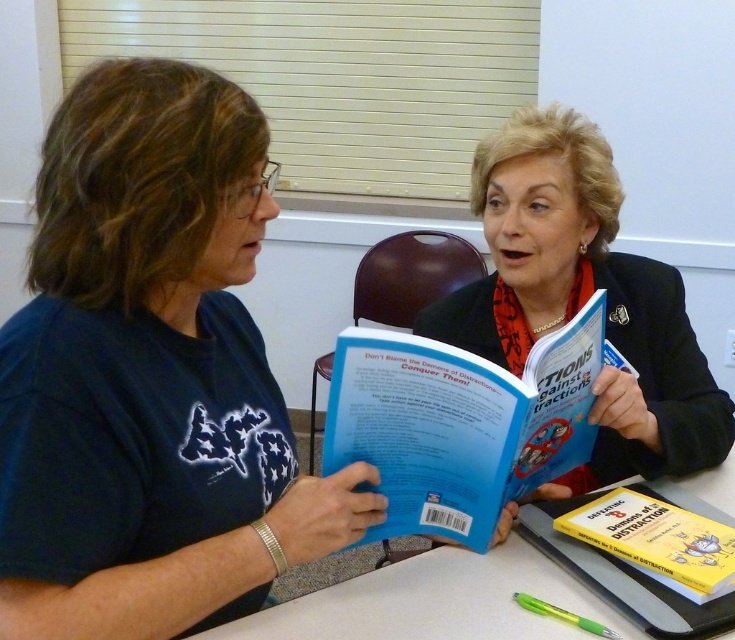
You are a librarian organizing books on a shelf. You have the blue paperback book at center and the yellow paperback book at lower right. According to their positions in the image, which book should you place to the left of the other on the shelf?

The blue paperback book at center should be placed to the left of the yellow paperback book at lower right because it is positioned on the left side of the yellow paperback book at lower right in the image.

You are a librarian who wants to place the blue paperback book at center and the yellow paperback book at lower right onto a shelf that is 10 inches long. Can both books fit on the shelf if placed side by side?

The blue paperback book at center and yellow paperback book at lower right are 8.73 inches apart, so they can fit on a 10 inch shelf when placed side by side since 8.73 inches is less than 10 inches.

You are a photographer setting up for a portrait session. You need to ensure that the matte black jacket at center and the white plastic table at center are both in focus. Based on their positions, which object should you focus on first to achieve proper depth of field?

The matte black jacket at center is above the white plastic table at center. To ensure both are in focus, you should focus on the matte black jacket at center first since it is closer to the camera, allowing the depth of field to extend backward to the table below.